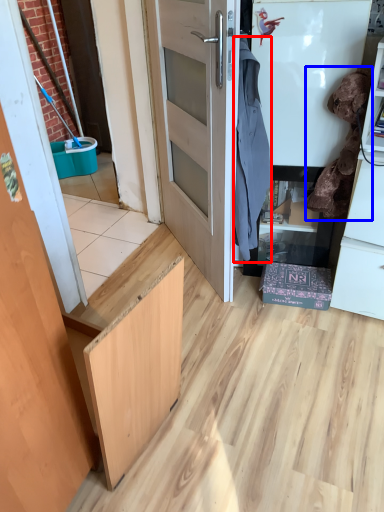
Question: Which object appears closest to the camera in this image, laundry (highlighted by a red box) or laundry (highlighted by a blue box)?

Choices:
 (A) laundry
 (B) laundry

Answer: (A)